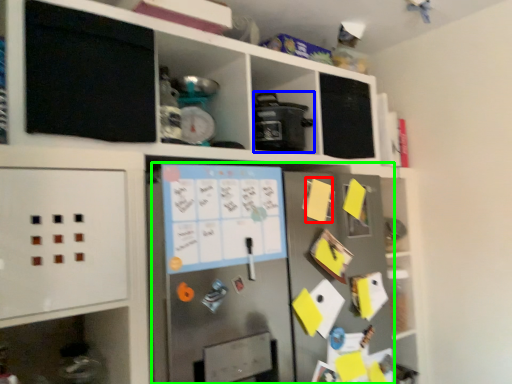
Question: Based on their relative distances, which object is farther from note (highlighted by a red box)? Choose from appliance (highlighted by a blue box) and fridge (highlighted by a green box).

Choices:
 (A) appliance
 (B) fridge

Answer: (B)